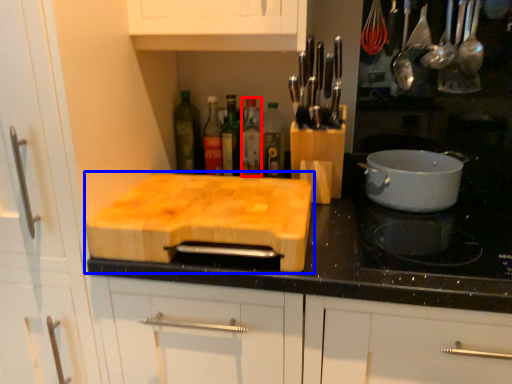
Question: Which of the following is the closest to the observer, bottle (highlighted by a red box) or cutting board (highlighted by a blue box)?

Choices:
 (A) bottle
 (B) cutting board

Answer: (B)